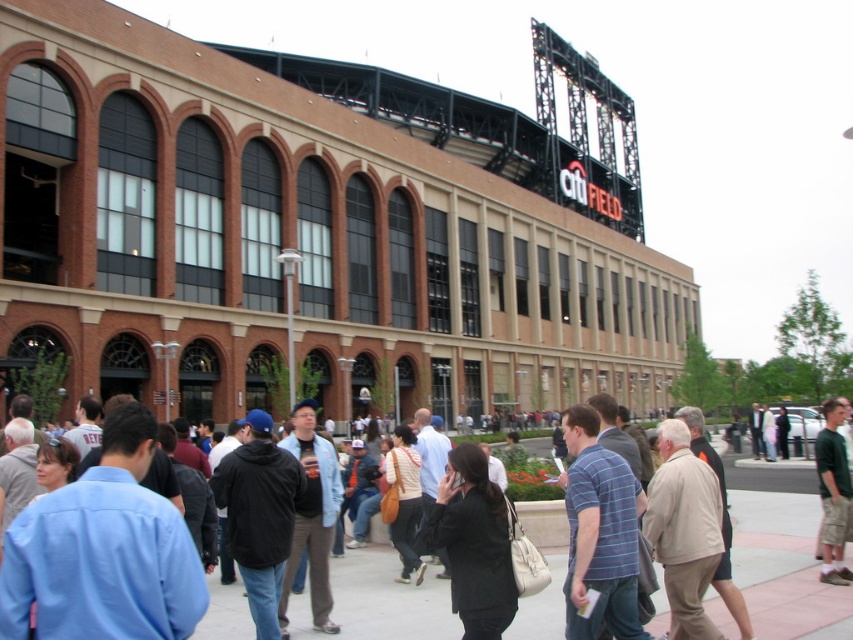
Is brown brick building at center above green cotton shirt at right?

Yes.

Is brown brick building at center positioned before green cotton shirt at right?

No, brown brick building at center is further to the viewer.

Between point (296, 148) and point (839, 573), which one is positioned behind?

The point (296, 148) is more distant.

You are a GUI agent. You are given a task and a screenshot of the screen. Output one action in this format:
    pyautogui.click(x=<x>, y=<y>)
    Task: Click on the brown brick building at center
    Image resolution: width=853 pixels, height=640 pixels.
    Given the screenshot: What is the action you would take?
    [300, 234]